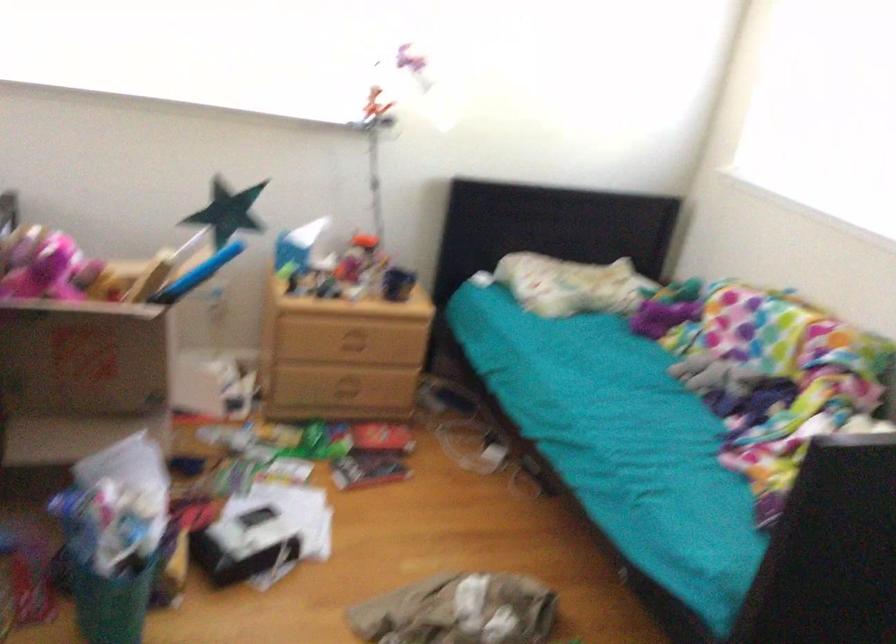
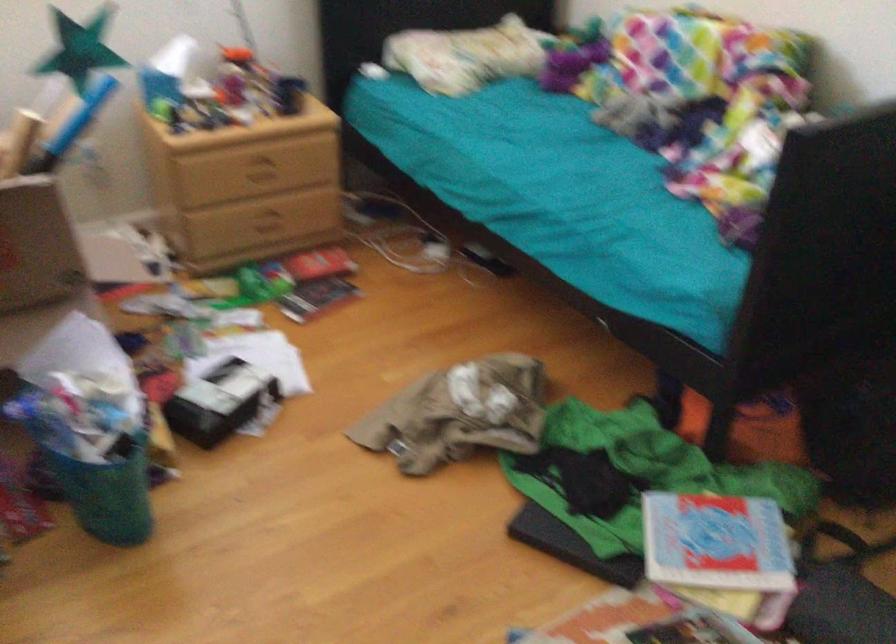
Find the pixel in the second image that matches the point at 347,388 in the first image.

(268, 222)